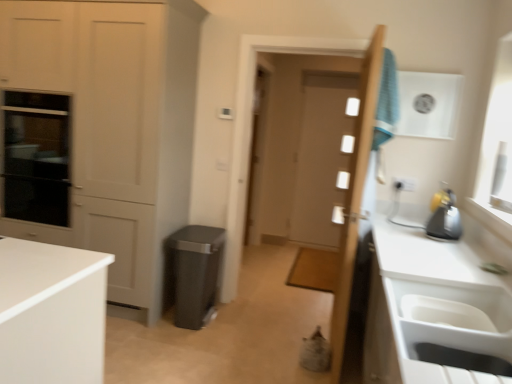
Question: Which direction should I rotate to look at wooden door at center, arranged as the 1th door when viewed from the front, — up or down?

Choices:
 (A) up
 (B) down

Answer: (B)

Question: Can you confirm if matte white cabinet at left is bigger than black glass oven at left?

Choices:
 (A) no
 (B) yes

Answer: (B)

Question: Can you confirm if matte white cabinet at left is thinner than black glass oven at left?

Choices:
 (A) yes
 (B) no

Answer: (B)

Question: Does matte white cabinet at left have a greater height compared to black glass oven at left?

Choices:
 (A) no
 (B) yes

Answer: (B)

Question: Does matte white cabinet at left appear on the left side of black glass oven at left?

Choices:
 (A) yes
 (B) no

Answer: (B)

Question: From a real-world perspective, is matte white cabinet at left physically above black glass oven at left?

Choices:
 (A) yes
 (B) no

Answer: (A)

Question: Is matte white cabinet at left oriented towards black glass oven at left?

Choices:
 (A) no
 (B) yes

Answer: (B)

Question: From the image's perspective, is clear glass screen door at center located beneath blue fabric laundry at upper right?

Choices:
 (A) yes
 (B) no

Answer: (A)

Question: Is clear glass screen door at center positioned before blue fabric laundry at upper right?

Choices:
 (A) yes
 (B) no

Answer: (B)

Question: Is clear glass screen door at center not near blue fabric laundry at upper right?

Choices:
 (A) yes
 (B) no

Answer: (A)

Question: From a real-world perspective, is clear glass screen door at center located beneath blue fabric laundry at upper right?

Choices:
 (A) no
 (B) yes

Answer: (B)

Question: Can you confirm if clear glass screen door at center is wider than blue fabric laundry at upper right?

Choices:
 (A) yes
 (B) no

Answer: (B)

Question: Can you confirm if clear glass screen door at center is taller than blue fabric laundry at upper right?

Choices:
 (A) yes
 (B) no

Answer: (A)

Question: Is clear glass screen door at center closer to the viewer compared to wooden door at center, the 2th door in the back-to-front sequence?

Choices:
 (A) no
 (B) yes

Answer: (A)